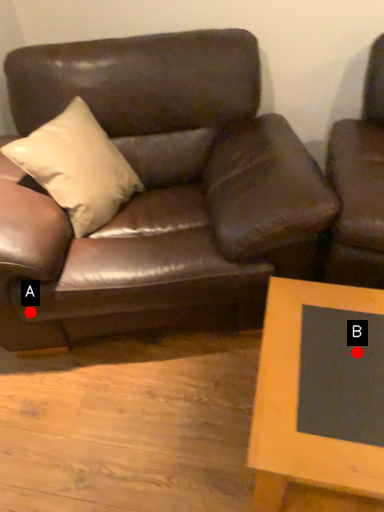
Question: Two points are circled on the image, labeled by A and B beside each circle. Which point is closer to the camera?

Choices:
 (A) A is closer
 (B) B is closer

Answer: (B)